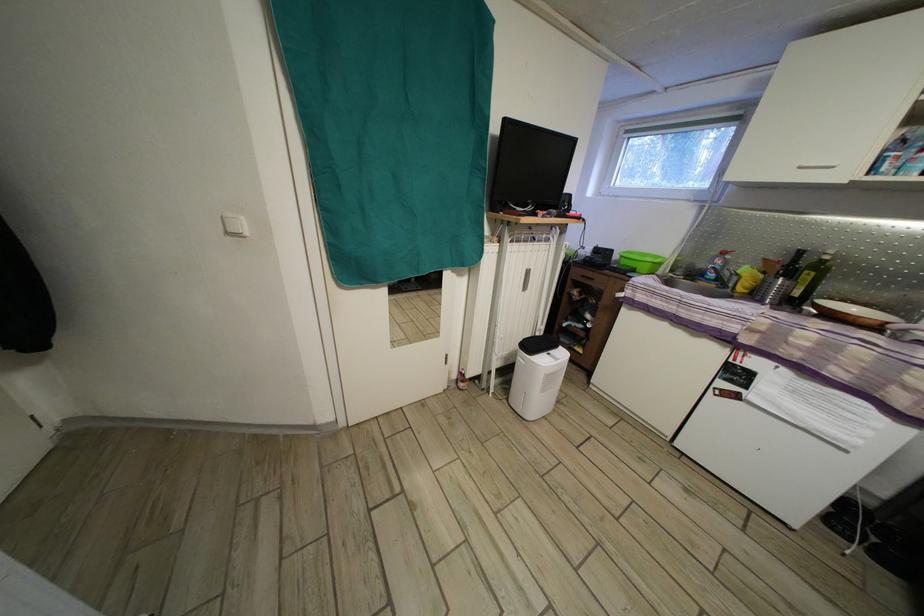
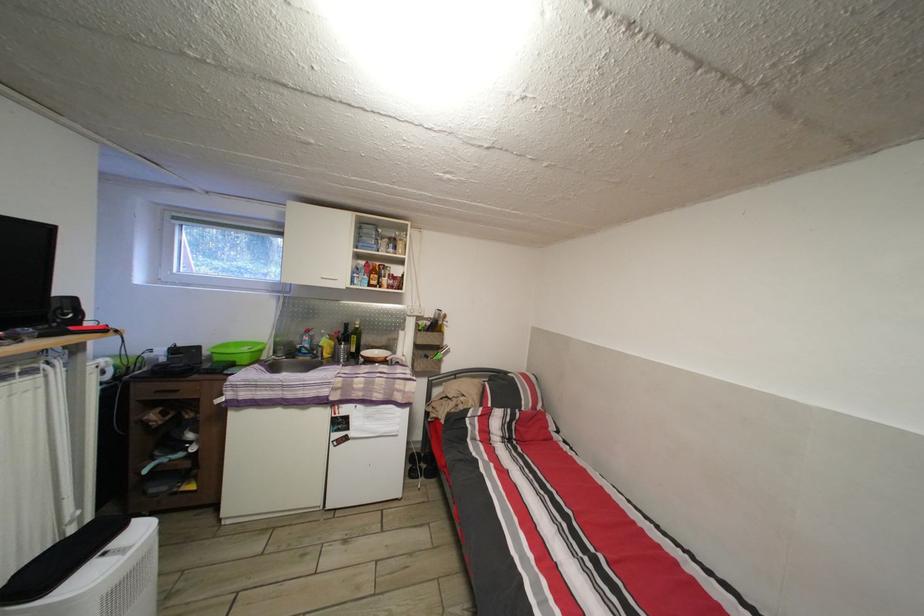
Where in the second image is the point corresponding to (x=600, y=286) from the first image?

(184, 398)